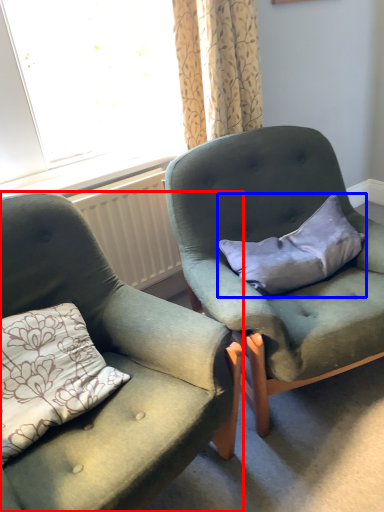
Question: Which object is closer to the camera taking this photo, chair (highlighted by a red box) or pillow (highlighted by a blue box)?

Choices:
 (A) chair
 (B) pillow

Answer: (A)